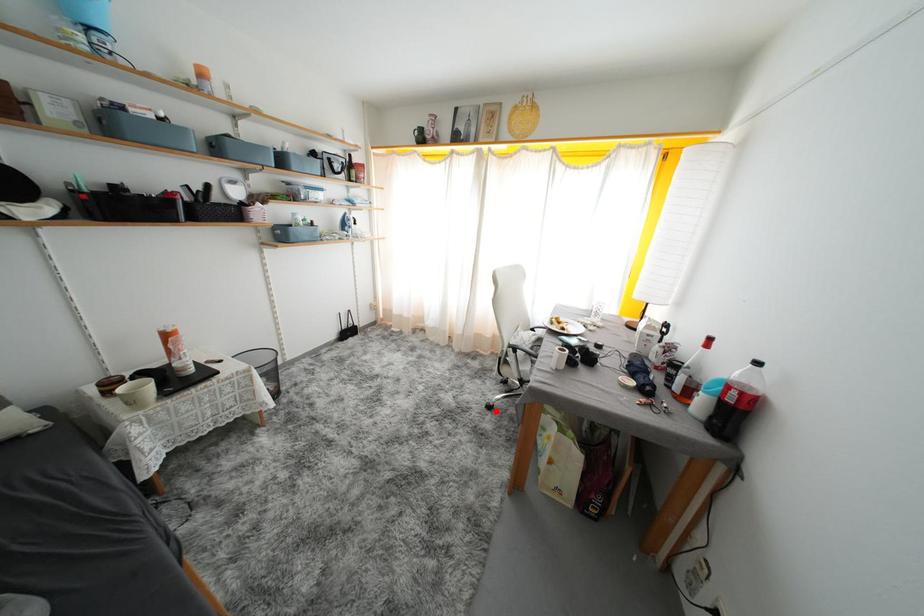
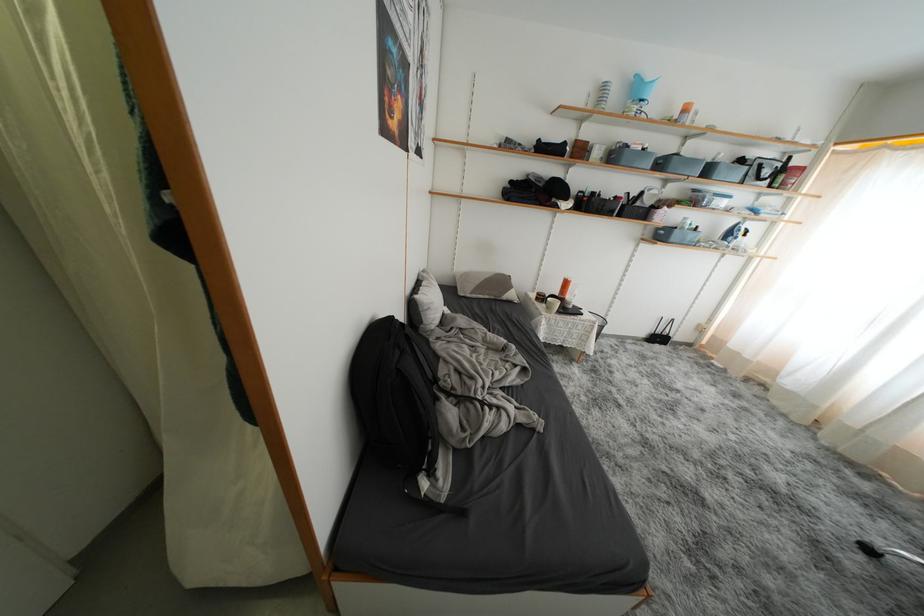
Question: I am providing you with two images of the same scene from different viewpoints. Given a red point in image1, look at the same physical point in image2. Is it:

Choices:
 (A) Closer to the viewpoint
 (B) Farther from the viewpoint

Answer: (B)